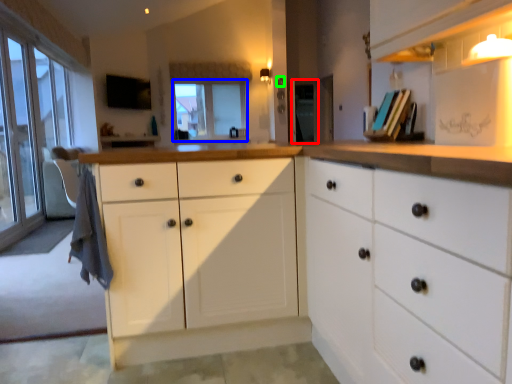
Question: Which object is positioned farthest from screen door (highlighted by a red box)? Select from window screen (highlighted by a blue box) and knob (highlighted by a green box).

Choices:
 (A) window screen
 (B) knob

Answer: (A)